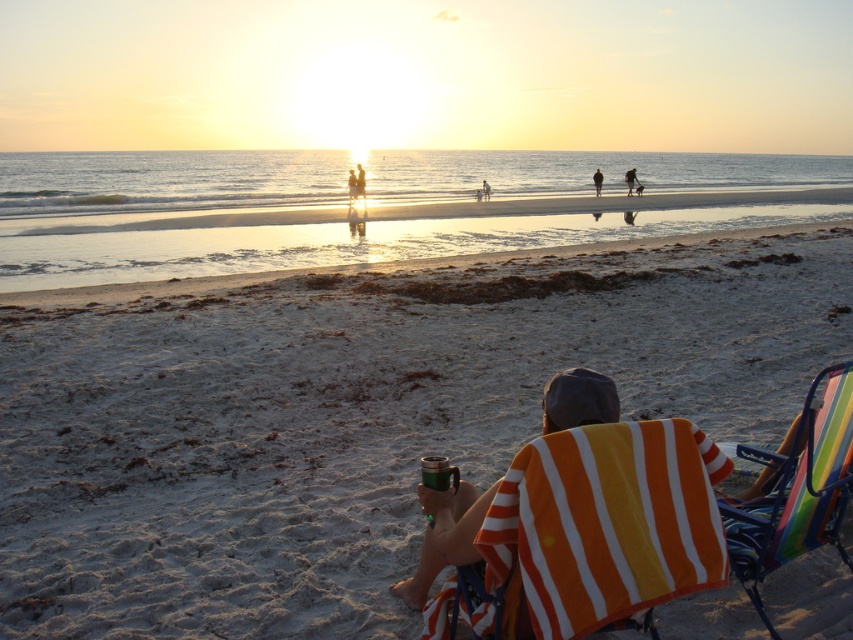
Question: Can you confirm if sandy beach at upper center is positioned to the left of dark brown leather jacket at upper center?

Choices:
 (A) yes
 (B) no

Answer: (A)

Question: Which point is farther from the camera taking this photo?

Choices:
 (A) (579, 424)
 (B) (485, 182)
 (C) (601, 182)

Answer: (C)

Question: Is white sandy beach at center behind dark brown leather jacket at upper center?

Choices:
 (A) yes
 (B) no

Answer: (B)

Question: Which object appears farthest from the camera in this image?

Choices:
 (A) sandy beach at upper center
 (B) dark brown leather jacket at upper center
 (C) orange striped towel at lower right

Answer: (B)

Question: Does white sandy beach at center have a lesser width compared to sandy beach at upper center?

Choices:
 (A) no
 (B) yes

Answer: (B)

Question: Which object is positioned closest to the white cotton shirt at center?

Choices:
 (A) smooth skin person at center
 (B) white sandy beach at center

Answer: (A)